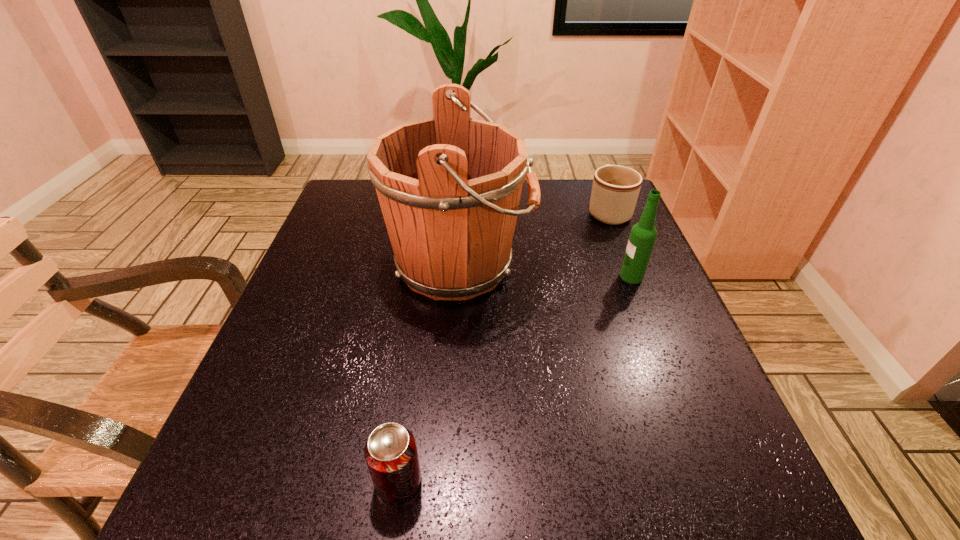
The width and height of the screenshot is (960, 540). I want to click on bucket, so click(x=449, y=187).

Locate an element on the screen. The image size is (960, 540). beer bottle is located at coordinates (643, 234).

What are the coordinates of `mug` in the screenshot? It's located at (615, 189).

Find the location of a particular element. the nearest object is located at coordinates (390, 452).

Image resolution: width=960 pixels, height=540 pixels. Find the location of `vacant area situated with the handle on the side of the tallest object`. vacant area situated with the handle on the side of the tallest object is located at coordinates (617, 264).

The height and width of the screenshot is (540, 960). I want to click on free space located on the label of the third shortest object, so click(597, 276).

Identify the location of free space located on the label of the third shortest object. (516, 276).

Find the location of a particular element. free space located 0.080m on the label of the third shortest object is located at coordinates (584, 276).

Where is `vacant space situated 0.070m on the left of the nearest object`? vacant space situated 0.070m on the left of the nearest object is located at coordinates (326, 481).

Where is `bucket present at the far edge`? The image size is (960, 540). bucket present at the far edge is located at coordinates (449, 187).